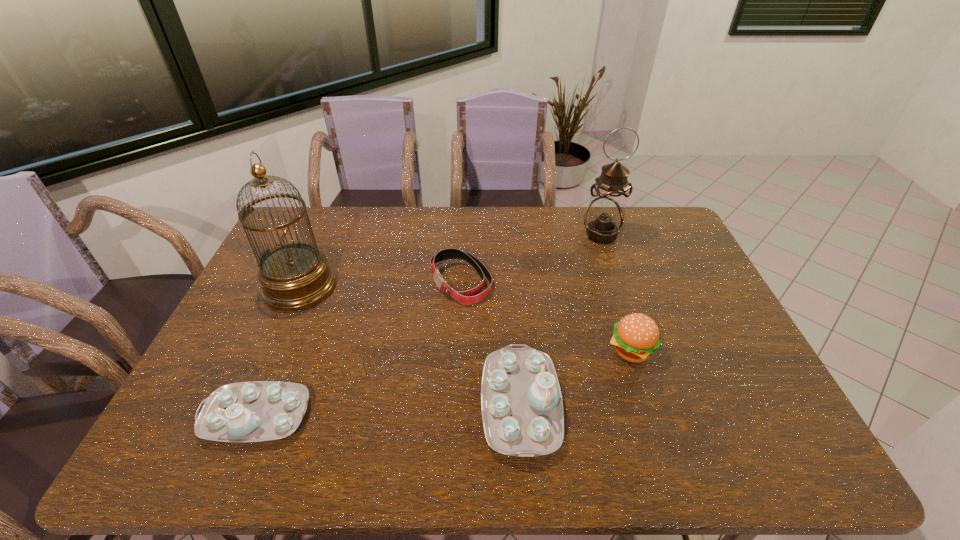
At what (x,y) coordinates should I click in order to perform the action: click on the shorter chinaware. Please return your answer as a coordinate pair (x, y). Looking at the image, I should click on (254, 411).

At what (x,y) coordinates should I click in order to perform the action: click on the right chinaware. Please return your answer as a coordinate pair (x, y). Image resolution: width=960 pixels, height=540 pixels. Looking at the image, I should click on (522, 411).

The height and width of the screenshot is (540, 960). What are the coordinates of `oil lamp` in the screenshot? It's located at (603, 219).

Locate an element on the screen. dog collar is located at coordinates (468, 297).

I want to click on hamburger, so click(636, 336).

Find the location of a particular element. birdcage is located at coordinates (294, 276).

Identify the location of blank area located on the right of the shorter chinaware. (450, 416).

This screenshot has height=540, width=960. I want to click on free point located on the back of the taller chinaware, so click(514, 313).

You are a GUI agent. You are given a task and a screenshot of the screen. Output one action in this format:
    pyautogui.click(x=<x>, y=<y>)
    Task: Click on the vacant space situated 0.160m on the left of the oil lamp
    The width and height of the screenshot is (960, 540).
    Given the screenshot: What is the action you would take?
    pyautogui.click(x=538, y=235)

The width and height of the screenshot is (960, 540). Find the location of `free space located on the front of the dog collar`. free space located on the front of the dog collar is located at coordinates (459, 318).